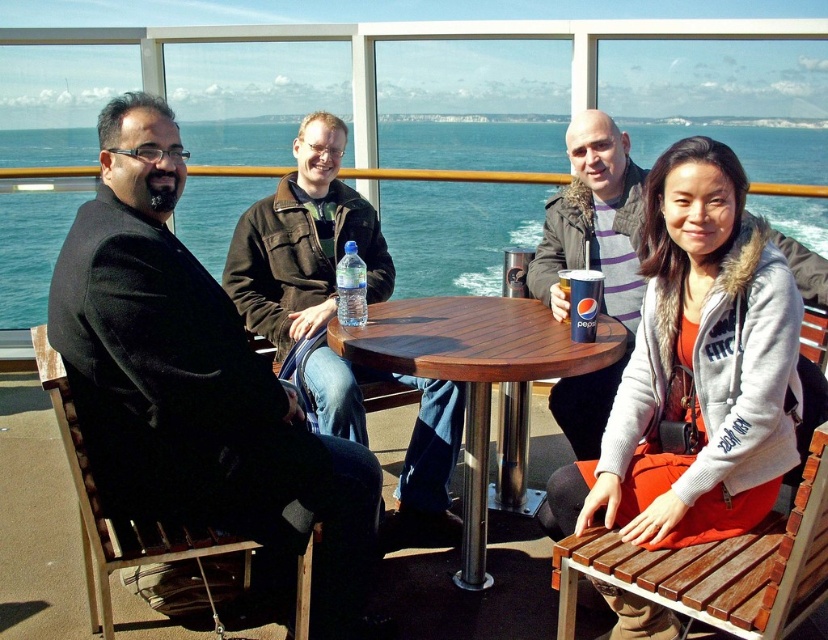
Question: Which of the following is the farthest from the observer?

Choices:
 (A) dark brown leather jacket at center
 (B) black wool coat at left

Answer: (A)

Question: Does black wool coat at left have a greater width compared to wooden table at center?

Choices:
 (A) yes
 (B) no

Answer: (B)

Question: Estimate the real-world distances between objects in this image. Which object is closer to the dark brown leather jacket at center?

Choices:
 (A) black wool coat at left
 (B) blue water at table center
 (C) matte plastic pepsi can at center
 (D) orange fabric jacket at lower right

Answer: (A)

Question: Which point is farther to the camera?

Choices:
 (A) (816, 166)
 (B) (292, 468)
 (C) (578, 305)
 (D) (472, 589)

Answer: (A)

Question: Is wooden table at center above matte plastic pepsi can at center?

Choices:
 (A) yes
 (B) no

Answer: (B)

Question: Does translucent plastic water bottle at center appear on the right side of matte plastic pepsi can at center?

Choices:
 (A) yes
 (B) no

Answer: (B)